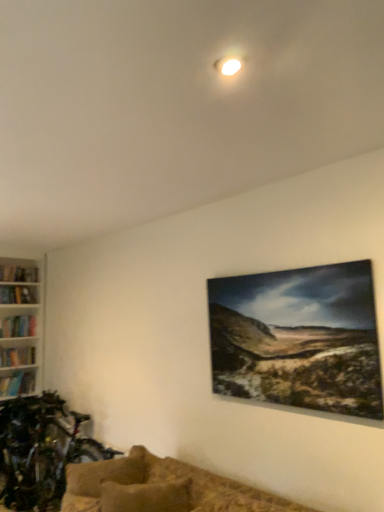
Question: Based on their positions, is brown textured couch at lower center located to the left or right of shiny metallic bicycle at lower left?

Choices:
 (A) left
 (B) right

Answer: (B)

Question: From their relative heights in the image, would you say brown textured couch at lower center is taller or shorter than shiny metallic bicycle at lower left?

Choices:
 (A) tall
 (B) short

Answer: (B)

Question: Based on their relative distances, which object is nearer to the textured beige pillow at lower center?

Choices:
 (A) brown textured couch at lower center
 (B) shiny metallic bicycle at lower left

Answer: (A)

Question: Estimate the real-world distances between objects in this image. Which object is closer to the shiny metallic bicycle at lower left?

Choices:
 (A) textured beige pillow at lower center
 (B) brown textured couch at lower center

Answer: (B)